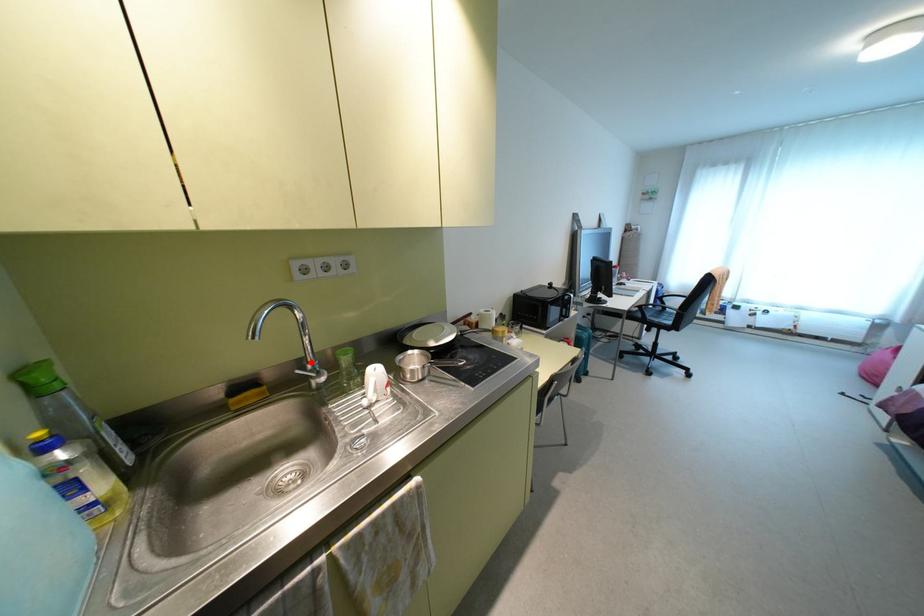
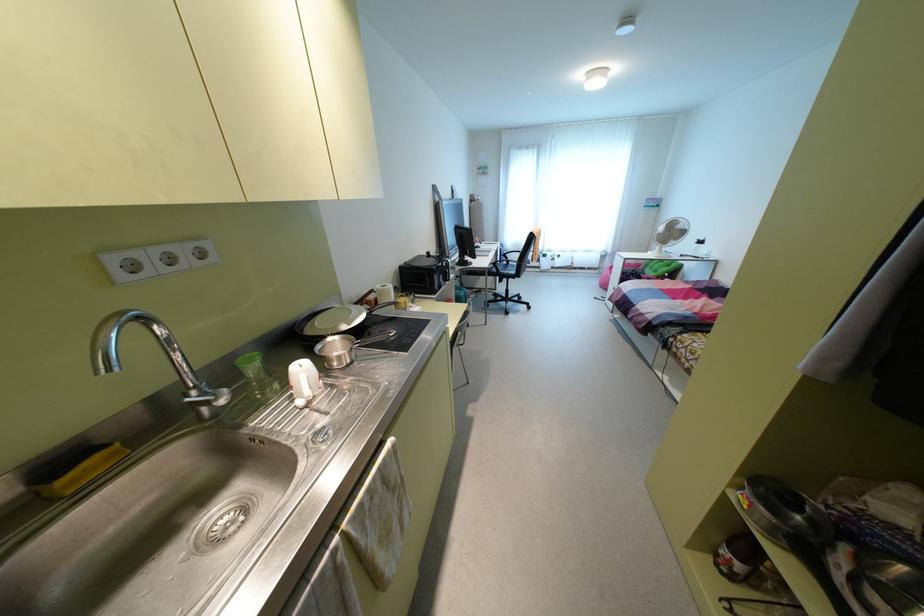
Where in the second image is the point corresponding to the highlighted location from the first image?

(195, 387)